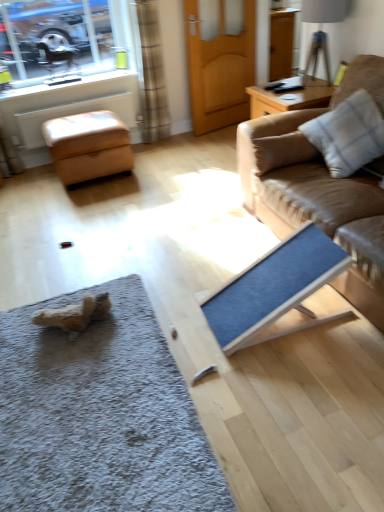
This screenshot has width=384, height=512. Identify the location of free space behind blue fabric yoga mat at center. (221, 257).